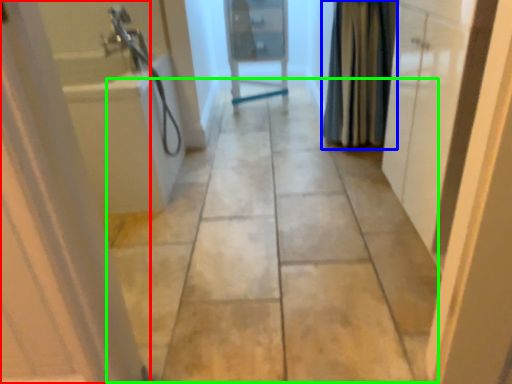
Question: Which object is positioned closest to door (highlighted by a red box)? Select from shower curtain (highlighted by a blue box) and path (highlighted by a green box).

Choices:
 (A) shower curtain
 (B) path

Answer: (B)